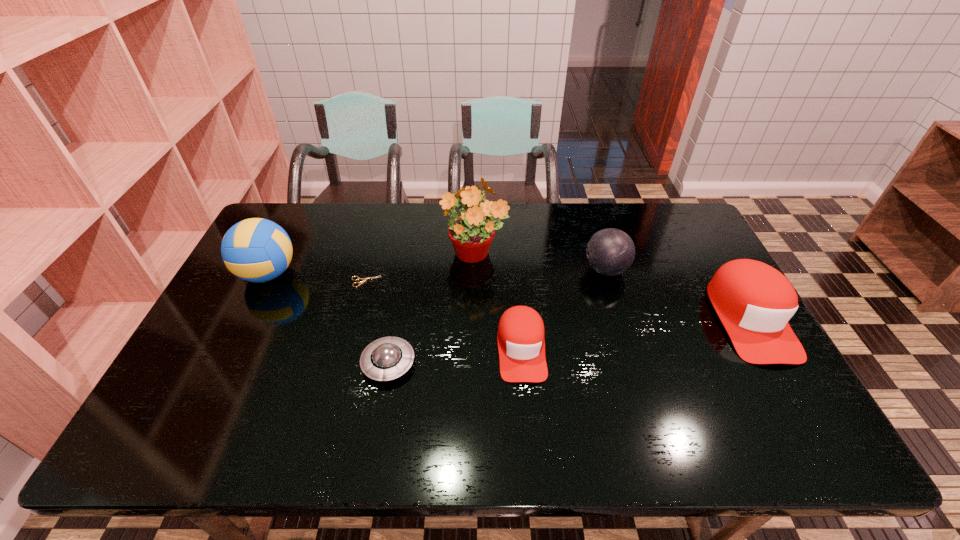
With all baseball caps evenly spaced, where should an extra baseball cap be placed on the left to continue the pattern? Please point out a vacant space. Please provide its 2D coordinates. Your answer should be formatted as a tuple, i.e. [(x, y)], where the tuple contains the x and y coordinates of a point satisfying the conditions above.

[(262, 383)]